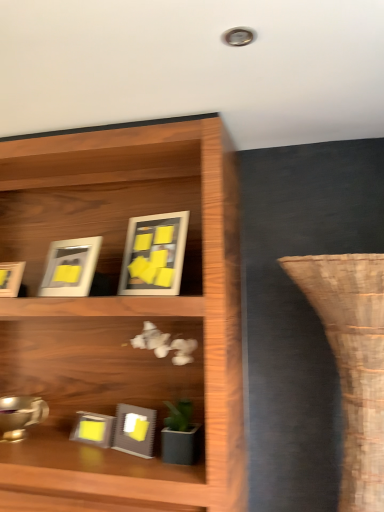
Question: From a real-world perspective, is matte gray picture frame at center, which appears as the 4th picture frame when viewed from the top, positioned above or below matte white picture frame at upper left, positioned as the 4th picture frame in bottom-to-top order?

Choices:
 (A) above
 (B) below

Answer: (B)

Question: Is matte gray picture frame at center, arranged as the second picture frame when ordered from the bottom, wider or thinner than matte white picture frame at upper left, which ranks as the second picture frame in top-to-bottom order?

Choices:
 (A) wide
 (B) thin

Answer: (A)

Question: Considering the real-world distances, which object is farthest from the matte white picture frame at upper left, which ranks as the second picture frame in top-to-bottom order?

Choices:
 (A) matte gray picture frame at center, which appears as the 4th picture frame when viewed from the top
 (B) brown woven vase at right
 (C) matte white picture frame at left, which is counted as the 3th picture frame, starting from the top
 (D) matte glass picture frame at center, which is the first picture frame in top-to-bottom order
 (E) matte gray picture frame at lower left, which is the 5th picture frame from top to bottom

Answer: (B)

Question: Considering the real-world distances, which object is farthest from the brown woven vase at right?

Choices:
 (A) matte glass picture frame at center, which is the first picture frame in top-to-bottom order
 (B) matte white picture frame at left, which ranks as the third picture frame in bottom-to-top order
 (C) matte gray picture frame at center, which appears as the 4th picture frame when viewed from the top
 (D) matte white picture frame at upper left, which ranks as the second picture frame in top-to-bottom order
 (E) matte gray picture frame at lower left, which is the 5th picture frame from top to bottom

Answer: (B)